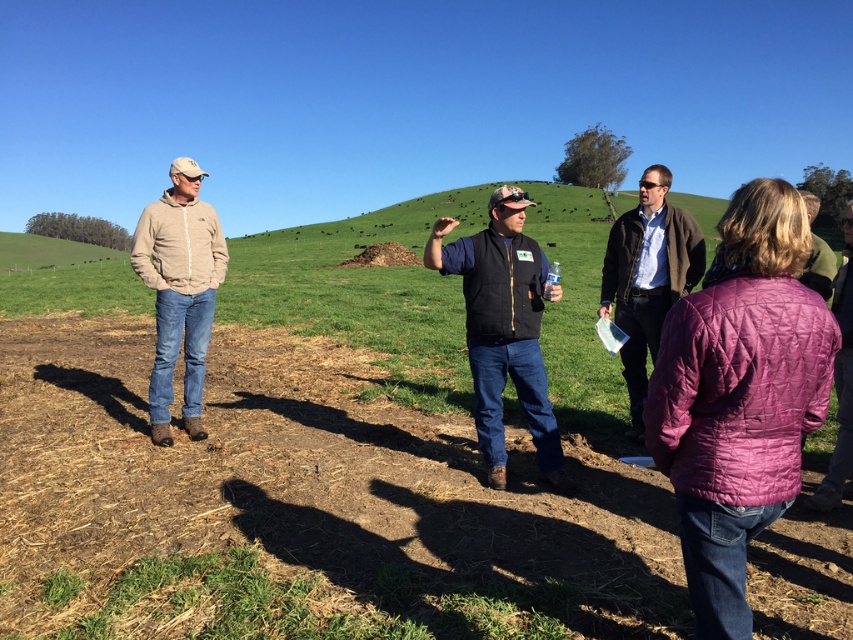
Question: Which point is closer to the camera?

Choices:
 (A) (207, 332)
 (B) (531, 300)
 (C) (645, 387)
 (D) (149, 621)

Answer: (D)

Question: Does brown dry dirt field at center lie in front of black softshell vest at center?

Choices:
 (A) yes
 (B) no

Answer: (B)

Question: Can you confirm if black softshell vest at center is smaller than brown woolen sweater at center?

Choices:
 (A) no
 (B) yes

Answer: (A)

Question: Based on their relative distances, which object is nearer to the black softshell vest at center?

Choices:
 (A) brown dry dirt field at center
 (B) beige fleece jacket at left
 (C) brown woolen sweater at center

Answer: (C)

Question: Which object appears farthest from the camera in this image?

Choices:
 (A) brown woolen sweater at center
 (B) beige fleece jacket at left
 (C) black softshell vest at center
 (D) brown dry dirt field at center

Answer: (B)

Question: Is brown dry dirt field at center smaller than black softshell vest at center?

Choices:
 (A) no
 (B) yes

Answer: (B)